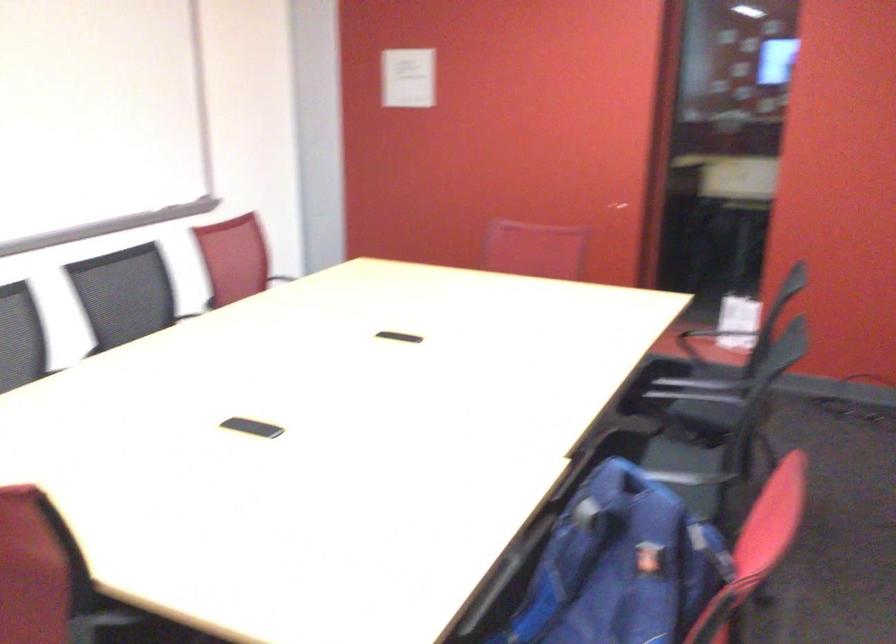
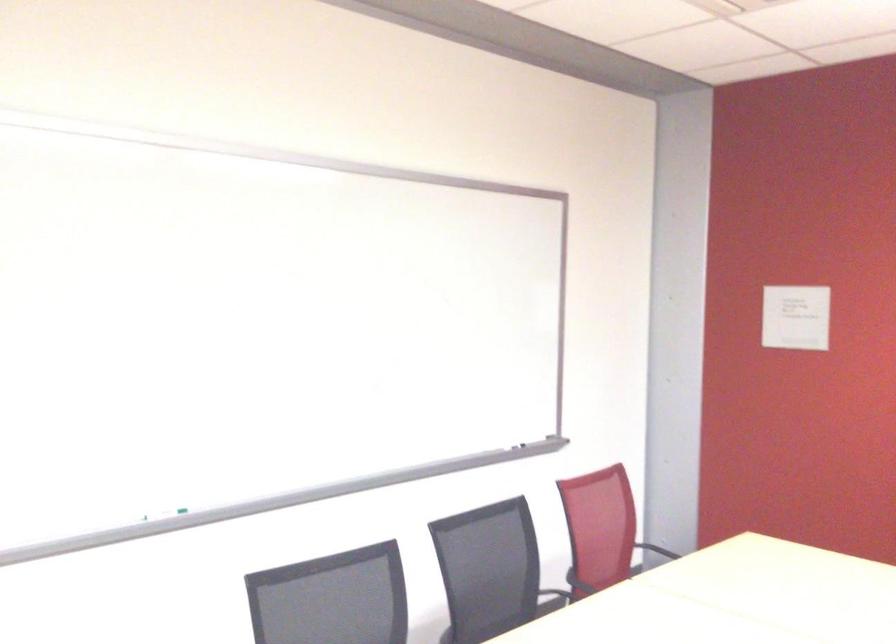
Question: The camera is either moving clockwise (left) or counter-clockwise (right) around the object. The first image is from the beginning of the video and the second image is from the end. Is the camera moving left or right when shooting the video?

Choices:
 (A) Left
 (B) Right

Answer: (B)